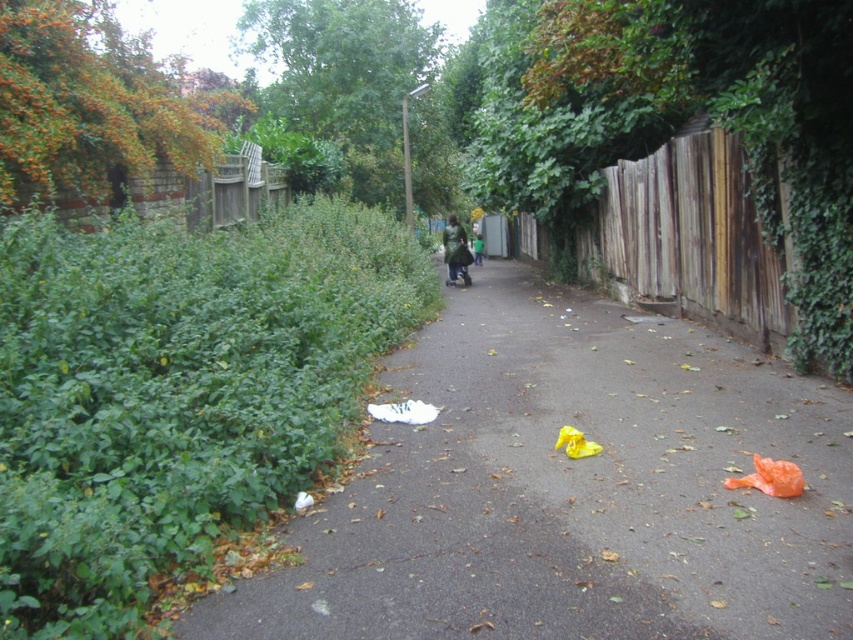
You are a pedestrian walking along the narrow pathway and see the wooden fence at right and the green matte jacket at center. Which object is wider from your perspective?

The wooden fence at right is wider than the green matte jacket at center.

You are a delivery person carrying a large package that requires a 50 feet clearance to maneuver safely. You are standing on the narrow pathway and see the wooden fence at right and the green matte jacket at center. Can you safely navigate between them with your package?

The distance between the wooden fence at right and the green matte jacket at center is 47.19 feet, which is less than the required 50 feet clearance. Therefore, you cannot safely navigate between them with your package.

You are walking along the pathway and see the white paper at center. If you want to pick it up, which direction should you move relative to the wooden fence on your left?

The white paper at center is located at point (569,490), so you should move towards the center of the pathway away from the wooden fence on your left to reach it.